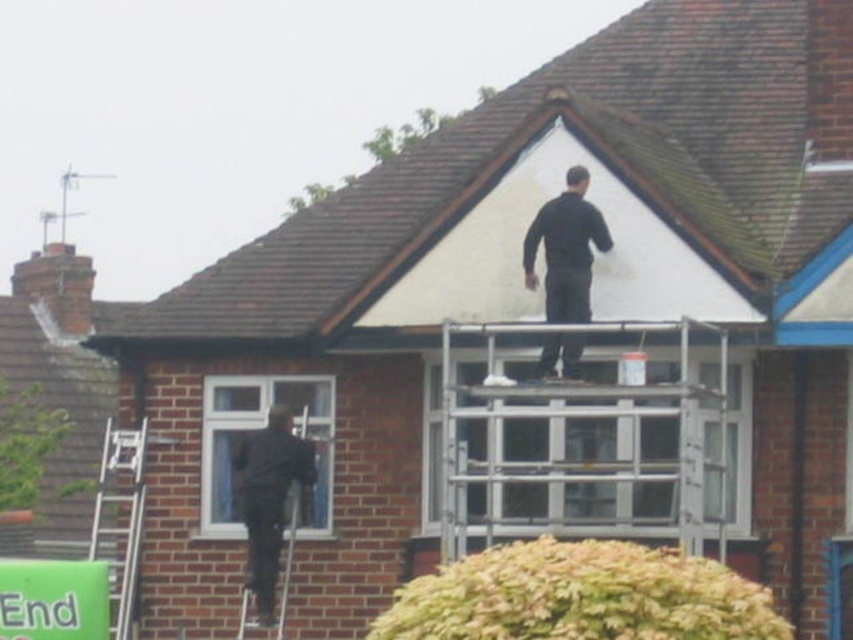
The height and width of the screenshot is (640, 853). Identify the location of silver metallic scaffolding at upper center. (572, 435).

Who is more distant from viewer, (724, 509) or (74, 252)?

The point (74, 252) is behind.

Identify the location of silver metallic scaffolding at upper center. (572, 435).

Between black matte jacket at upper center and red brick chimney at upper left, which one is positioned higher?

Positioned higher is red brick chimney at upper left.

From the picture: Can you confirm if black matte jacket at upper center is shorter than red brick chimney at upper left?

Yes, black matte jacket at upper center is shorter than red brick chimney at upper left.

Which is in front, point (572, 342) or point (53, 260)?

Positioned in front is point (572, 342).

Find the location of a particular element. This screenshot has width=853, height=640. black matte jacket at upper center is located at coordinates (566, 250).

Where is `white matte roof at upper center`? The height and width of the screenshot is (640, 853). white matte roof at upper center is located at coordinates (511, 132).

In the scene shown: Can you confirm if white matte roof at upper center is wider than red brick chimney at upper left?

Correct, the width of white matte roof at upper center exceeds that of red brick chimney at upper left.

The height and width of the screenshot is (640, 853). Describe the element at coordinates (511, 132) in the screenshot. I see `white matte roof at upper center` at that location.

Locate an element on the screen. white matte roof at upper center is located at coordinates (511, 132).